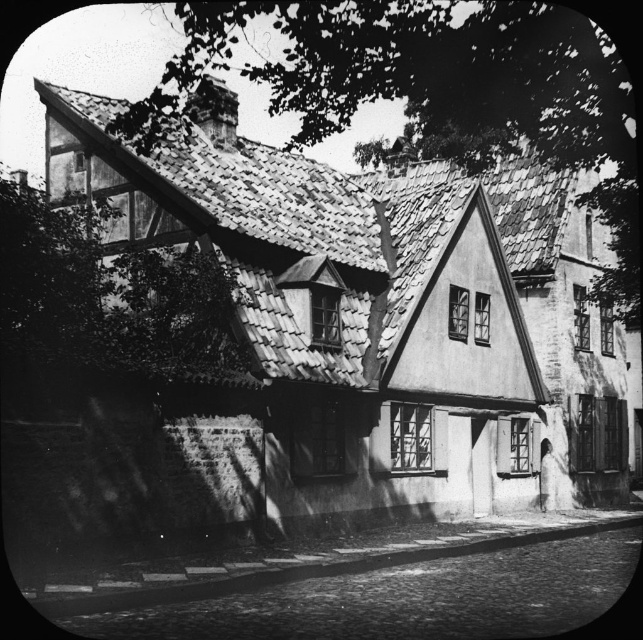
Question: Which of the following is the farthest from the observer?

Choices:
 (A) green leafy tree at upper center
 (B) green leafy tree at upper left

Answer: (A)

Question: Can you confirm if green leafy tree at upper center is positioned below green leafy tree at upper left?

Choices:
 (A) no
 (B) yes

Answer: (A)

Question: Is green leafy tree at upper center behind green leafy tree at upper left?

Choices:
 (A) no
 (B) yes

Answer: (B)

Question: Which object is closer to the camera taking this photo?

Choices:
 (A) green leafy tree at upper left
 (B) green leafy tree at upper center

Answer: (A)

Question: Is green leafy tree at upper center positioned behind green leafy tree at upper left?

Choices:
 (A) yes
 (B) no

Answer: (A)

Question: Which point is closer to the camera taking this photo?

Choices:
 (A) (376, 1)
 (B) (212, 326)

Answer: (A)